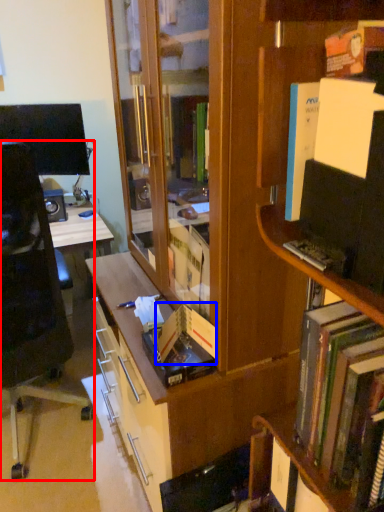
Question: Which object is further to the camera taking this photo, chair (highlighted by a red box) or paperback book (highlighted by a blue box)?

Choices:
 (A) chair
 (B) paperback book

Answer: (A)